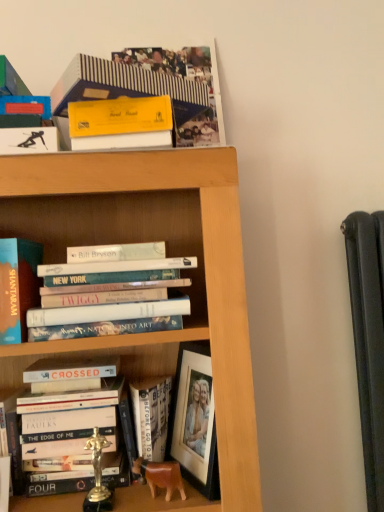
Question: Would you say striped paper book at upper center, acting as the first book starting from the top, is outside matte blue book at left, placed as the 3th book when sorted from top to bottom?

Choices:
 (A) no
 (B) yes

Answer: (B)

Question: Is striped paper book at upper center, acting as the first book starting from the top, turned away from matte blue book at left, placed as the 3th book when sorted from top to bottom?

Choices:
 (A) yes
 (B) no

Answer: (B)

Question: Can you confirm if striped paper book at upper center, acting as the first book starting from the top, is bigger than matte blue book at left, placed as the 3th book when sorted from top to bottom?

Choices:
 (A) no
 (B) yes

Answer: (A)

Question: From the image's perspective, would you say striped paper book at upper center, acting as the first book starting from the top, is shown under matte blue book at left, placed as the 3th book when sorted from top to bottom?

Choices:
 (A) no
 (B) yes

Answer: (A)

Question: From a real-world perspective, is striped paper book at upper center, acting as the first book starting from the top, located higher than matte blue book at left, the third book positioned from the bottom?

Choices:
 (A) yes
 (B) no

Answer: (A)

Question: Considering the positions of hardcover books at center, arranged as the fourth book when ordered from the bottom, and hardcover book at lower left, marked as the 2th book in a bottom-to-top arrangement, in the image, is hardcover books at center, arranged as the fourth book when ordered from the bottom, bigger or smaller than hardcover book at lower left, marked as the 2th book in a bottom-to-top arrangement,?

Choices:
 (A) big
 (B) small

Answer: (A)

Question: From the image's perspective, is hardcover books at center, arranged as the fourth book when ordered from the bottom, located above or below hardcover book at lower left, marked as the 2th book in a bottom-to-top arrangement?

Choices:
 (A) above
 (B) below

Answer: (A)

Question: In terms of height, does hardcover books at center, placed as the 2th book when sorted from top to bottom, look taller or shorter compared to hardcover book at lower left, marked as the 2th book in a bottom-to-top arrangement?

Choices:
 (A) tall
 (B) short

Answer: (B)

Question: Is hardcover books at center, arranged as the fourth book when ordered from the bottom, to the left or to the right of hardcover book at lower left, marked as the 2th book in a bottom-to-top arrangement, in the image?

Choices:
 (A) right
 (B) left

Answer: (A)

Question: Is point (94, 414) closer or farther from the camera than point (49, 289)?

Choices:
 (A) farther
 (B) closer

Answer: (A)

Question: From the image's perspective, relative to hardcover books at center, placed as the 2th book when sorted from top to bottom, is hardcover book at lower left, marked as the 2th book in a bottom-to-top arrangement, above or below?

Choices:
 (A) above
 (B) below

Answer: (B)

Question: Looking at the image, does hardcover book at lower left, which appears as the 4th book when viewed from the top, seem bigger or smaller compared to hardcover books at center, placed as the 2th book when sorted from top to bottom?

Choices:
 (A) big
 (B) small

Answer: (B)

Question: Is hardcover book at lower left, marked as the 2th book in a bottom-to-top arrangement, taller or shorter than hardcover books at center, arranged as the fourth book when ordered from the bottom?

Choices:
 (A) short
 (B) tall

Answer: (B)

Question: From the image's perspective, is matte blue book at left, the third book positioned from the bottom, above or below striped paper book at upper center, which is the 5th book from bottom to top?

Choices:
 (A) above
 (B) below

Answer: (B)

Question: Based on their sizes in the image, would you say matte blue book at left, placed as the 3th book when sorted from top to bottom, is bigger or smaller than striped paper book at upper center, acting as the first book starting from the top?

Choices:
 (A) big
 (B) small

Answer: (A)